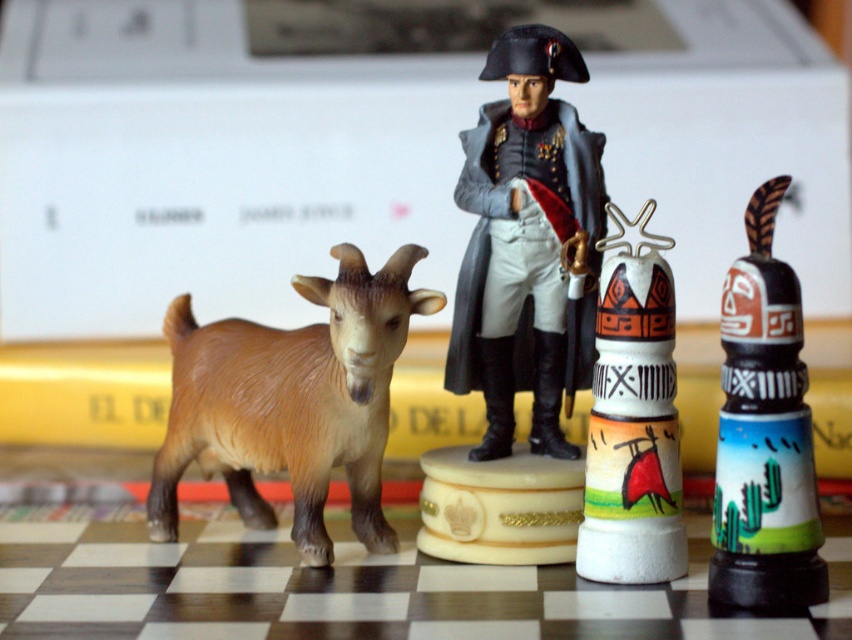
You are a collector who wants to display both the painted ceramic totem pole at right and the white ceramic totem pole at center right on a shelf. Which totem pole should be placed in front to ensure both are visible?

The white ceramic totem pole at center right should be placed in front since it is shorter than the painted ceramic totem pole at right, allowing both to be seen without obstruction.

You are standing in front of the chessboard and want to place a small plastic figurine of a goat on the left side of the board. The goat is light brown with darker brown horns and legs, and its body is slightly angled towards the center right of the image. There is also a figurine of a man dressed in historical attire positioned at point (263, 372), which is 1.16 meters from the viewer. If you want to place another figurine closer to you than the man, where should you place it?

You should place the new figurine closer to you than the point (263, 372) where the man is located since the man is 1.16 meters away from the viewer. Placing it within less than 1.16 meters would ensure it is closer.

You are a miniature figure collector. You want to place a new figurine of a knight exactly halfway between the brown matte goat at left and the edge of the chessboard. Where should you place the knight?

The knight should be placed at the midpoint between the brown matte goat at left and the chessboard edge. Since the goat is at coordinates (291, 401), the midpoint would depend on the edge direction. If placing along the horizontal axis, the knight would be at (291, 200). If vertically, it would be (146, 401). Specify the direction for precise placement.